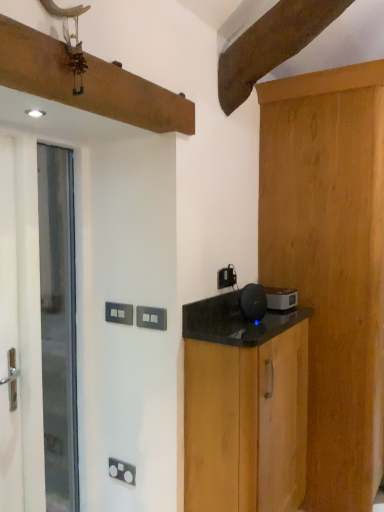
Question: Considering the relative sizes of satin black speaker at right, the first appliance when ordered from back to front, and black wood cabinet at right, which is the 1th cabinetry in left-to-right order, in the image provided, is satin black speaker at right, the first appliance when ordered from back to front, thinner than black wood cabinet at right, which is the 1th cabinetry in left-to-right order,?

Choices:
 (A) yes
 (B) no

Answer: (A)

Question: Could you tell me if satin black speaker at right, the first appliance when ordered from back to front, is facing black wood cabinet at right, marked as the 2th cabinetry in a right-to-left arrangement?

Choices:
 (A) yes
 (B) no

Answer: (B)

Question: From the image's perspective, would you say satin black speaker at right, acting as the second appliance starting from the front, is shown under black wood cabinet at right, marked as the 2th cabinetry in a right-to-left arrangement?

Choices:
 (A) yes
 (B) no

Answer: (B)

Question: Considering the relative sizes of satin black speaker at right, the first appliance when ordered from back to front, and black wood cabinet at right, which is the 1th cabinetry in left-to-right order, in the image provided, is satin black speaker at right, the first appliance when ordered from back to front, taller than black wood cabinet at right, which is the 1th cabinetry in left-to-right order,?

Choices:
 (A) no
 (B) yes

Answer: (A)

Question: From a real-world perspective, relative to black plastic electric outlet at upper center, marked as the 1th electric outlet in a right-to-left arrangement, is white matte screen door at left vertically above or below?

Choices:
 (A) above
 (B) below

Answer: (B)

Question: From the image's perspective, is white matte screen door at left above or below black plastic electric outlet at upper center, the 3th electric outlet viewed from the front?

Choices:
 (A) above
 (B) below

Answer: (B)

Question: Is point (16, 317) positioned closer to the camera than point (218, 278)?

Choices:
 (A) farther
 (B) closer

Answer: (B)

Question: Considering the relative positions of white matte screen door at left and black plastic electric outlet at upper center, which appears as the 3th electric outlet when viewed from the left, in the image provided, is white matte screen door at left to the left or to the right of black plastic electric outlet at upper center, which appears as the 3th electric outlet when viewed from the left,?

Choices:
 (A) right
 (B) left

Answer: (B)

Question: From a real-world perspective, is black plastic electric outlet at upper center, the 1th electric outlet from the top, physically located above or below white glossy door at left?

Choices:
 (A) above
 (B) below

Answer: (A)

Question: Does point (223, 267) appear closer or farther from the camera than point (52, 174)?

Choices:
 (A) closer
 (B) farther

Answer: (A)

Question: Visually, is black plastic electric outlet at upper center, the 1th electric outlet from the top, positioned to the left or to the right of white glossy door at left?

Choices:
 (A) left
 (B) right

Answer: (B)

Question: Is black plastic electric outlet at upper center, marked as the 1th electric outlet in a right-to-left arrangement, wider or thinner than white glossy door at left?

Choices:
 (A) wide
 (B) thin

Answer: (B)

Question: From the image's perspective, is black plastic electric outlet at upper center, the 1th electric outlet from the top, located above or below white matte screen door at left?

Choices:
 (A) above
 (B) below

Answer: (A)

Question: Considering the positions of black plastic electric outlet at upper center, which is the first electric outlet from back to front, and white matte screen door at left in the image, is black plastic electric outlet at upper center, which is the first electric outlet from back to front, taller or shorter than white matte screen door at left?

Choices:
 (A) short
 (B) tall

Answer: (A)